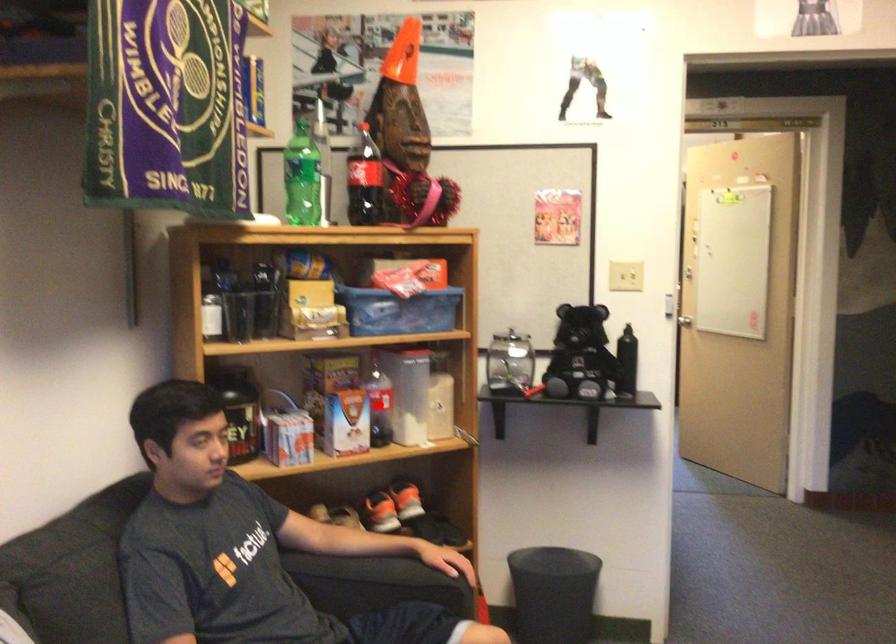
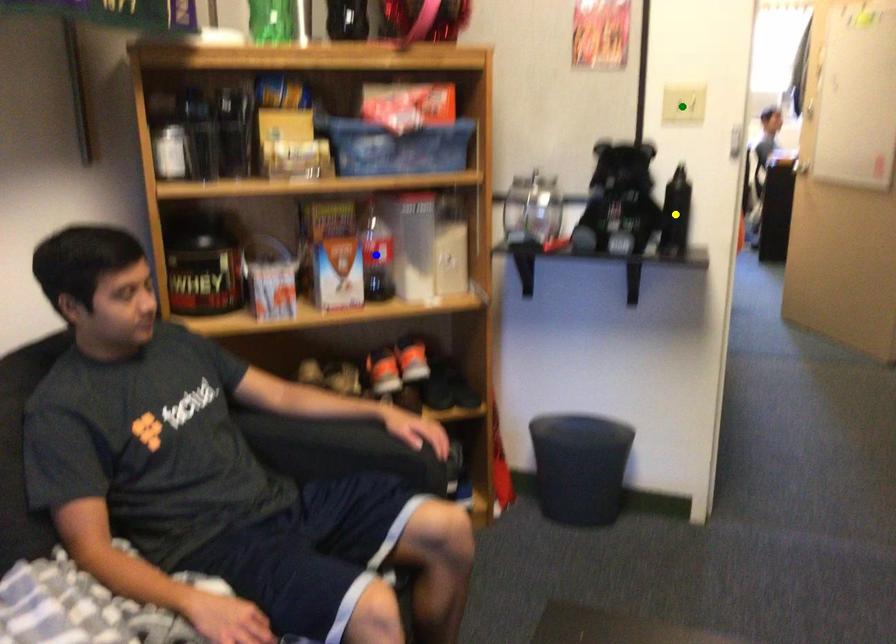
Question: I am providing you with two images of the same scene from different viewpoints. A red point is marked on the first image. You are given multiple points on the second image. Can you choose the point in image 2 that corresponds to the point in image 1?

Choices:
 (A) green point
 (B) yellow point
 (C) blue point

Answer: (C)